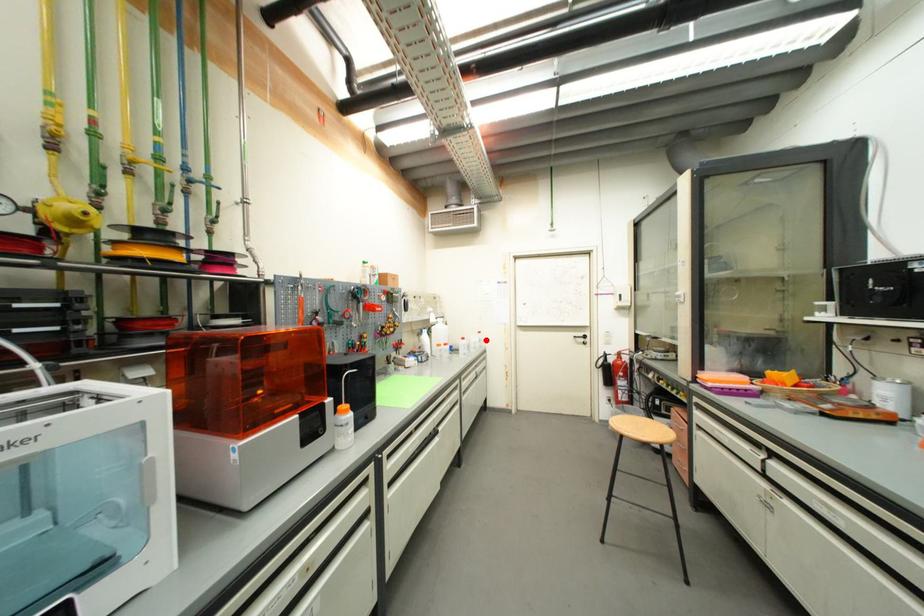
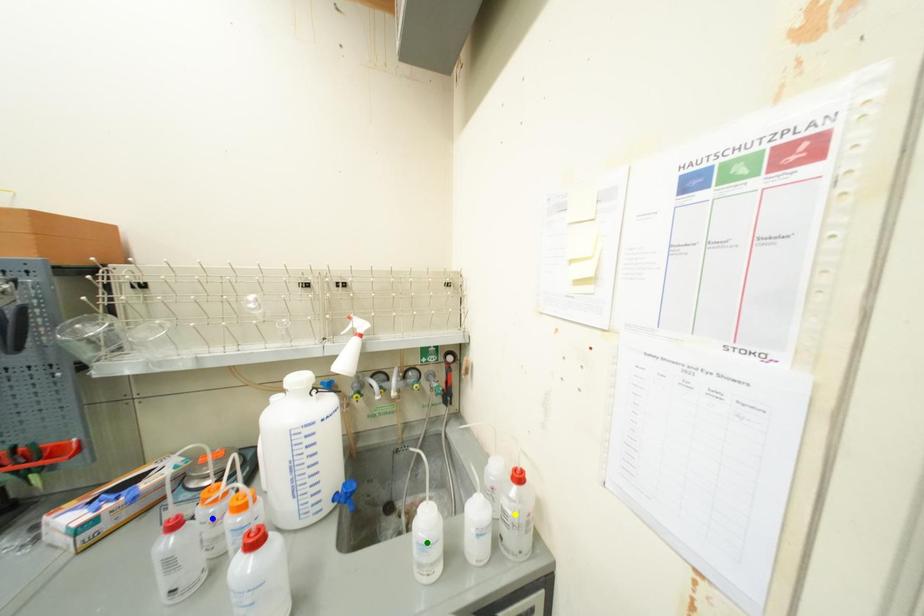
Question: I am providing you with two images of the same scene from different viewpoints. A red point is marked on the first image. You are given multiple points on the second image. Which mark in image 2 goes with the point in image 1?

Choices:
 (A) yellow point
 (B) blue point
 (C) green point

Answer: (A)